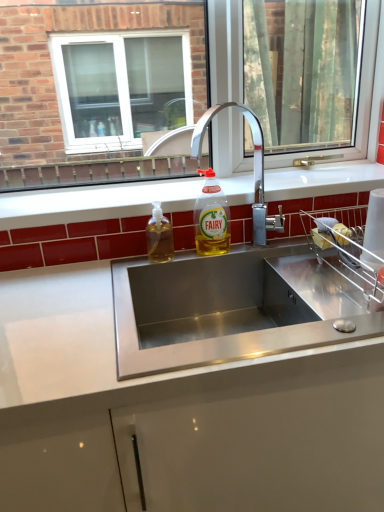
Find the location of a particular element. This screenshot has height=512, width=384. free spot to the right of yellow translucent liquid at sink center, which ranks as the 2th bottle in left-to-right order is located at coordinates (264, 247).